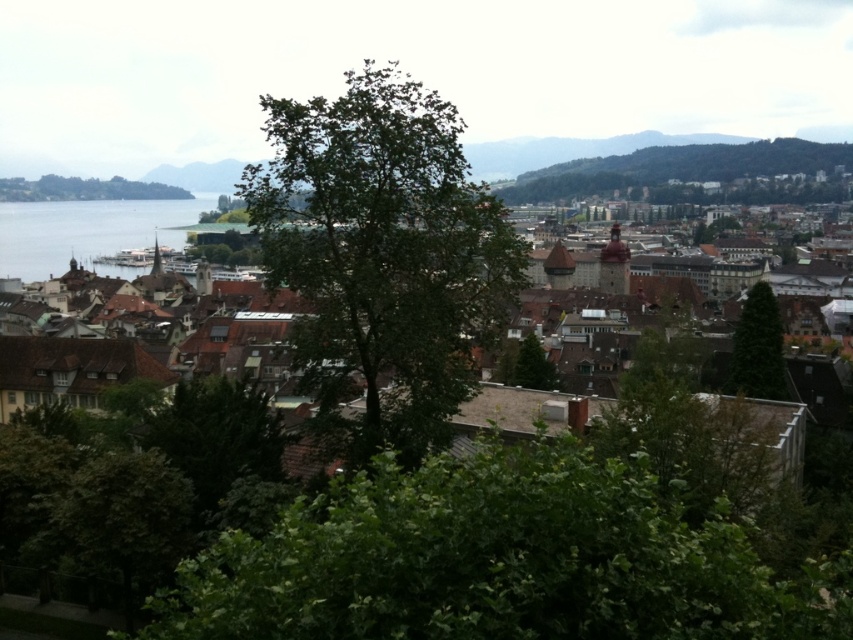
Which is below, brown tiled roofs at center or green leafy tree at center-right?

green leafy tree at center-right

Is brown tiled roofs at center smaller than green leafy tree at center-right?

No.

Which is behind, point (3, 252) or point (749, 336)?

Positioned behind is point (3, 252).

Find the location of `brown tiled roofs at center`. brown tiled roofs at center is located at coordinates 85,230.

Based on the photo, is green leafy tree at center shorter than brown tiled roofs at center?

Indeed, green leafy tree at center has a lesser height compared to brown tiled roofs at center.

Does green leafy tree at center have a greater width compared to brown tiled roofs at center?

No, green leafy tree at center is not wider than brown tiled roofs at center.

Is point (456, 202) in front of point (54, 212)?

Yes.

Locate an element on the screen. green leafy tree at center is located at coordinates (383, 252).

Consider the image. Does brown tiled roofs at center appear on the right side of green leafy tree at left?

Yes, brown tiled roofs at center is to the right of green leafy tree at left.

Is brown tiled roofs at center positioned at the back of green leafy tree at left?

No, brown tiled roofs at center is closer to the viewer.

Does point (149, 237) come closer to viewer compared to point (39, 193)?

Yes.

Locate an element on the screen. brown tiled roofs at center is located at coordinates (85, 230).